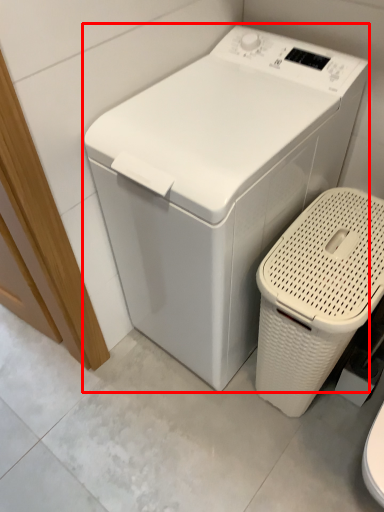
Question: In this image, where is washing machine (annotated by the red box) located relative to garbage?

Choices:
 (A) left
 (B) right

Answer: (A)